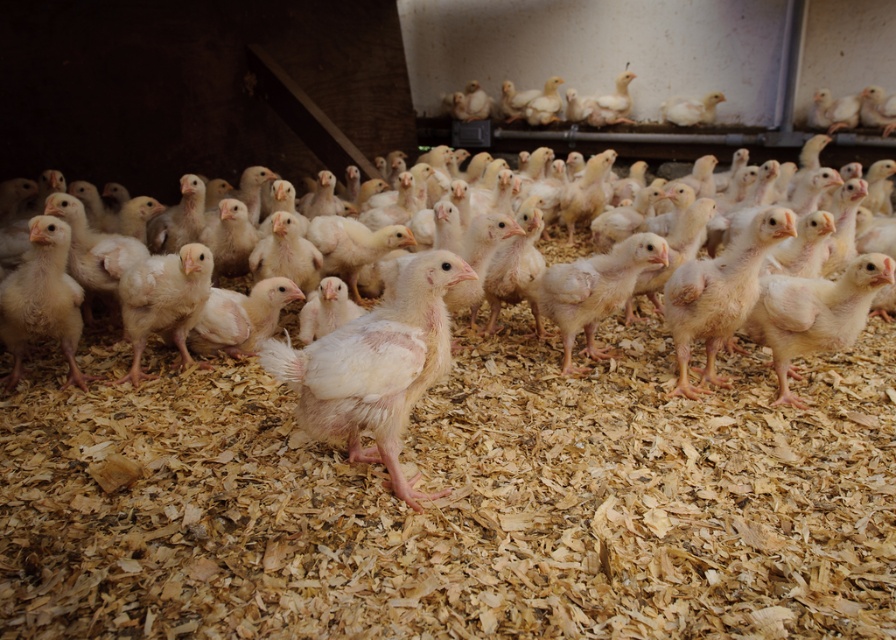
In the scene shown: Can you confirm if white fluffy chicken at center is positioned below white fluffy chick at center?

No.

Between white fluffy chicken at center and white fluffy chick at center, which one is positioned higher?

white fluffy chicken at center is higher up.

Image resolution: width=896 pixels, height=640 pixels. In order to click on white fluffy chicken at center in this screenshot , I will do `click(467, 484)`.